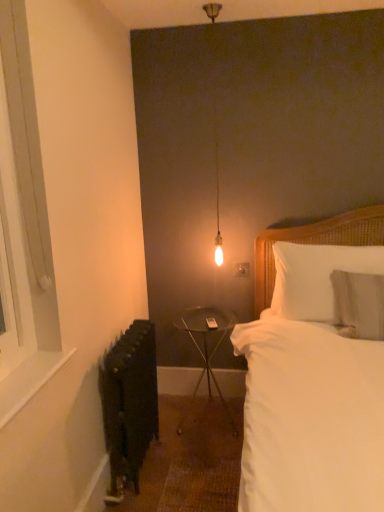
In order to click on blank space above white wood at lower left (from a real-world perspective) in this screenshot , I will do point(25,370).